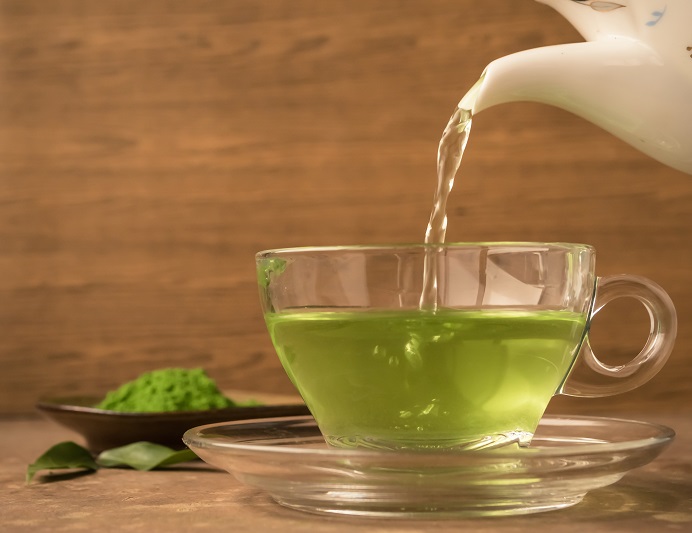
Find the location of a particular element. This screenshot has height=533, width=692. tea pot pour spout is located at coordinates (540, 74).